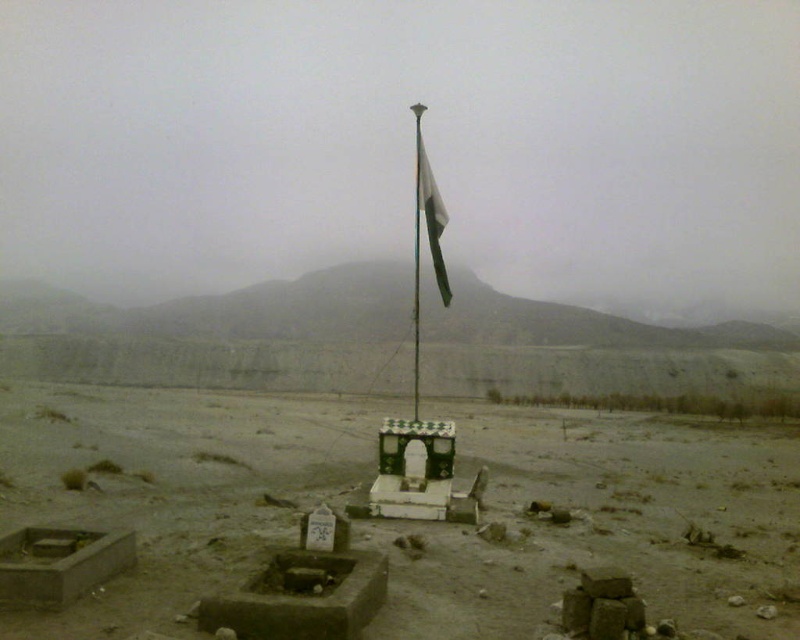
Question: Can you confirm if dull brown dirt field at center is wider than metallic flag pole at center?

Choices:
 (A) no
 (B) yes

Answer: (B)

Question: Which point is farther to the camera?

Choices:
 (A) (414, 358)
 (B) (414, 288)
 (C) (425, 220)
 (D) (501, 512)

Answer: (B)

Question: In this image, where is dull brown dirt field at center located relative to metallic flag pole at center?

Choices:
 (A) below
 (B) above

Answer: (A)

Question: Does white fabric flag at center appear on the left side of metallic flag pole at center?

Choices:
 (A) yes
 (B) no

Answer: (B)

Question: Which of the following is the closest to the observer?

Choices:
 (A) white fabric flag at center
 (B) white glossy flag pole at center

Answer: (B)

Question: Which point is closer to the camera taking this photo?

Choices:
 (A) (414, 336)
 (B) (400, 621)

Answer: (B)